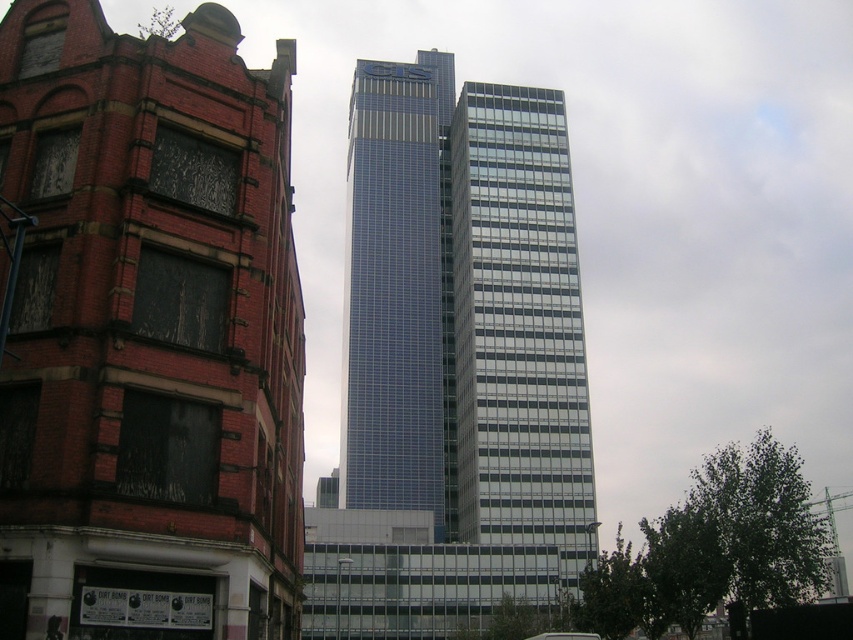
Does blue glassy tower at center appear on the left side of blue glass skyscraper at center?

Indeed, blue glassy tower at center is positioned on the left side of blue glass skyscraper at center.

Consider the image. Is blue glassy tower at center thinner than blue glass skyscraper at center?

In fact, blue glassy tower at center might be wider than blue glass skyscraper at center.

The image size is (853, 640). Describe the element at coordinates (453, 364) in the screenshot. I see `blue glassy tower at center` at that location.

This screenshot has height=640, width=853. I want to click on blue glassy tower at center, so click(x=453, y=364).